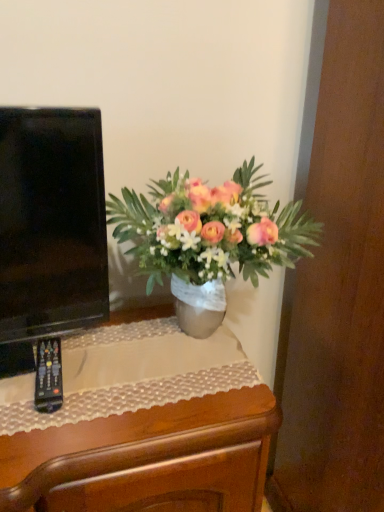
Where is `free space to the back side of black plastic remote at lower left`? This screenshot has width=384, height=512. free space to the back side of black plastic remote at lower left is located at coordinates (96, 343).